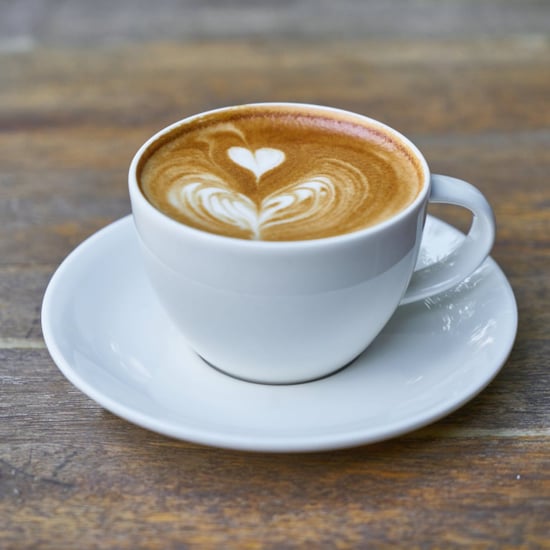
Where is `saucer`? This screenshot has height=550, width=550. saucer is located at coordinates (275, 424).